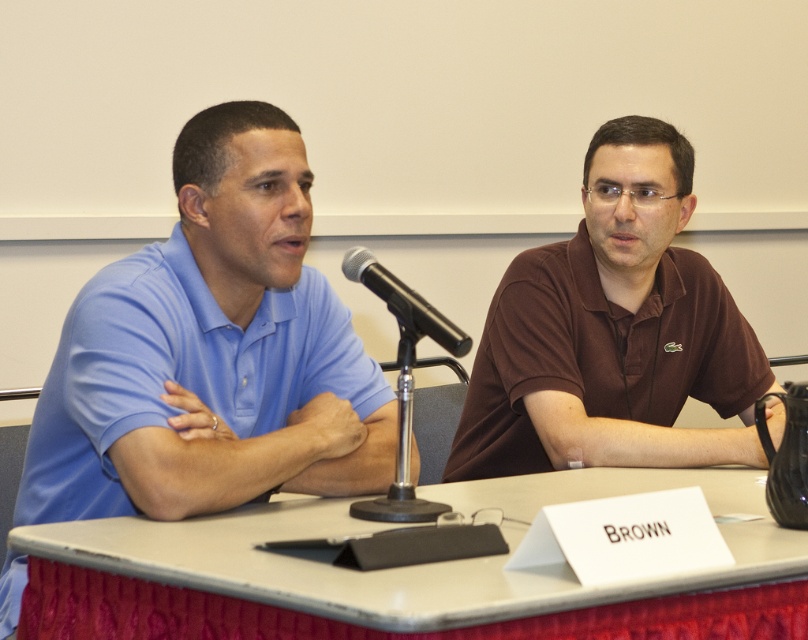
You are a photographer setting up for a group photo. You need to position two people so that they are exactly 30 inches apart. Currently, the matte blue polo shirt at left and brown matte shirt at center are 28.30 inches apart. Can you fit a standard 1.5 inch thick book between them to reach the desired distance?

The current distance between the matte blue polo shirt at left and brown matte shirt at center is 28.30 inches. Adding a 1.5 inch thick book would make the total distance 29.8 inches, which is still less than the required 30 inches. Therefore, you cannot achieve the desired 30 inches by just adding the book.

You are a photographer trying to capture a candid shot of the two individuals at the panel discussion. You need to position yourself such that both speakers are visible without any obstruction. Given their positions at point coordinates point (718, 403) and point (365, 268), which speaker should you avoid standing behind to ensure both are in frame?

You should avoid standing behind point (718, 403) because it is behind point (365, 268). Positioning yourself behind the latter would allow both speakers to be visible without obstruction.